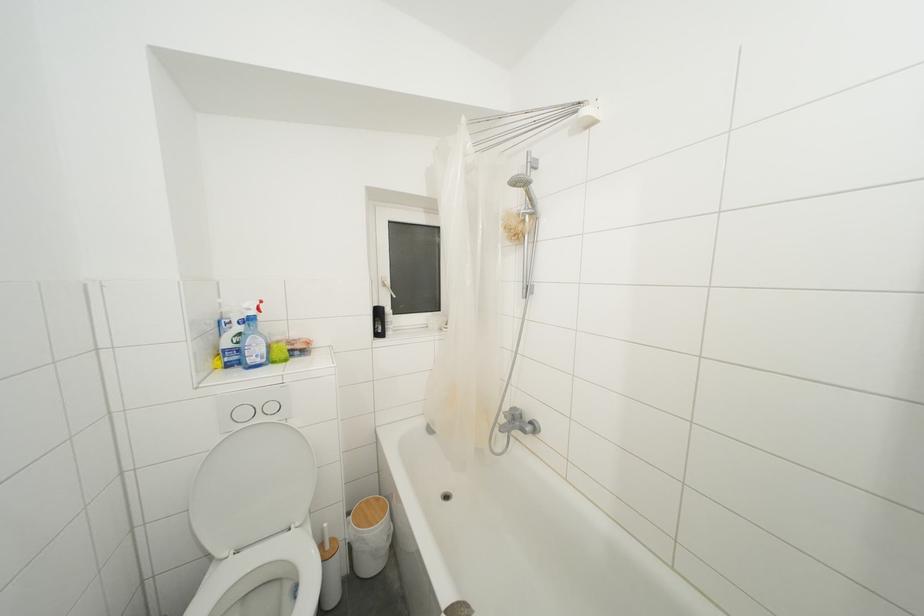
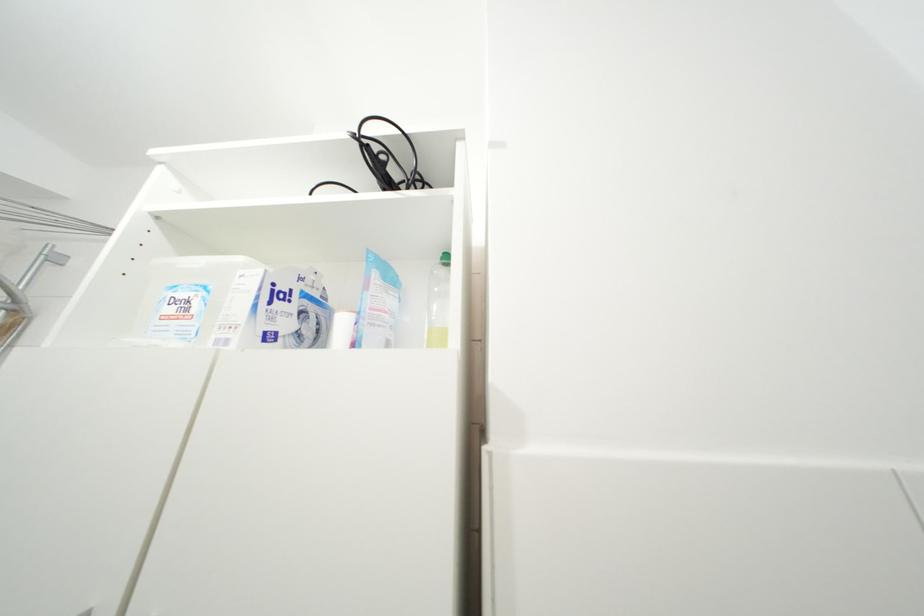
First-person continuous shooting, in which direction is the camera rotating?

The camera rotated toward right-up.